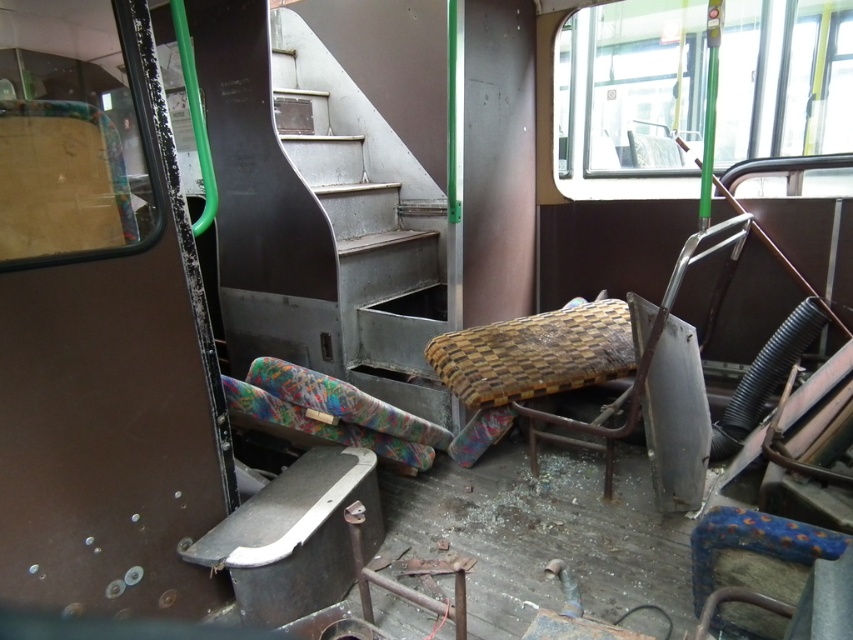
Is point (570, 308) in front of point (343, 396)?

No, it is not.

Who is positioned more to the left, woven fabric chair at center or multicolored fabric pillow at lower left?

multicolored fabric pillow at lower left

Between point (596, 316) and point (432, 440), which one is positioned in front?

Positioned in front is point (432, 440).

Locate an element on the screen. Image resolution: width=853 pixels, height=640 pixels. woven fabric chair at center is located at coordinates (569, 353).